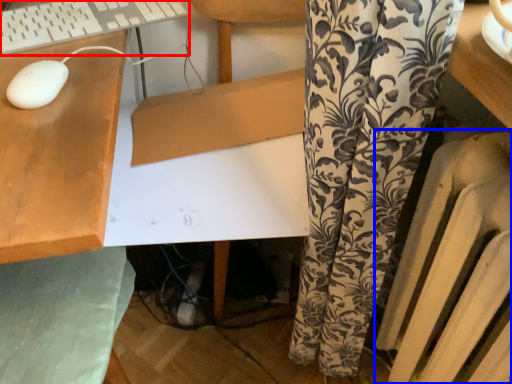
Question: Which point is closer to the camera, computer keyboard (highlighted by a red box) or radiator (highlighted by a blue box)?

Choices:
 (A) computer keyboard
 (B) radiator

Answer: (B)